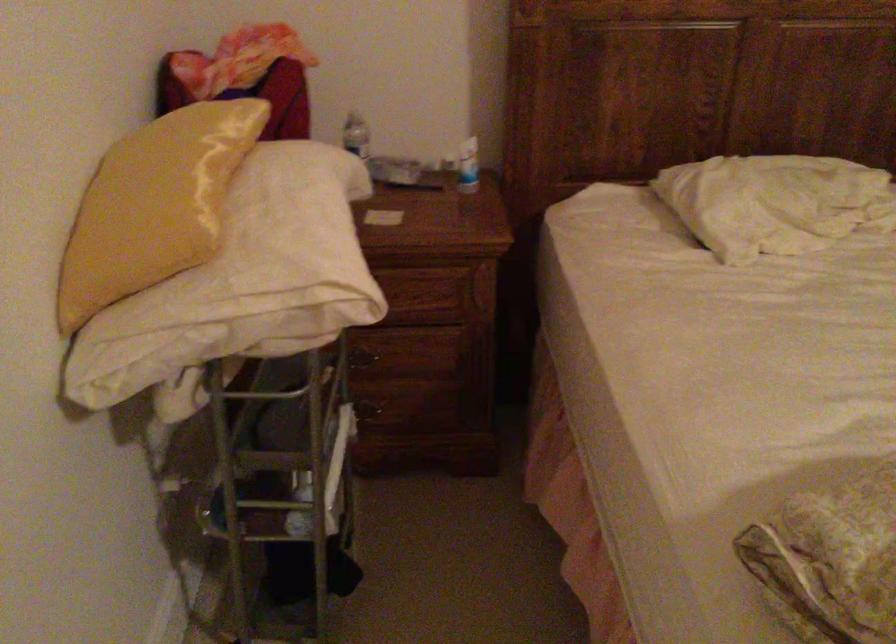
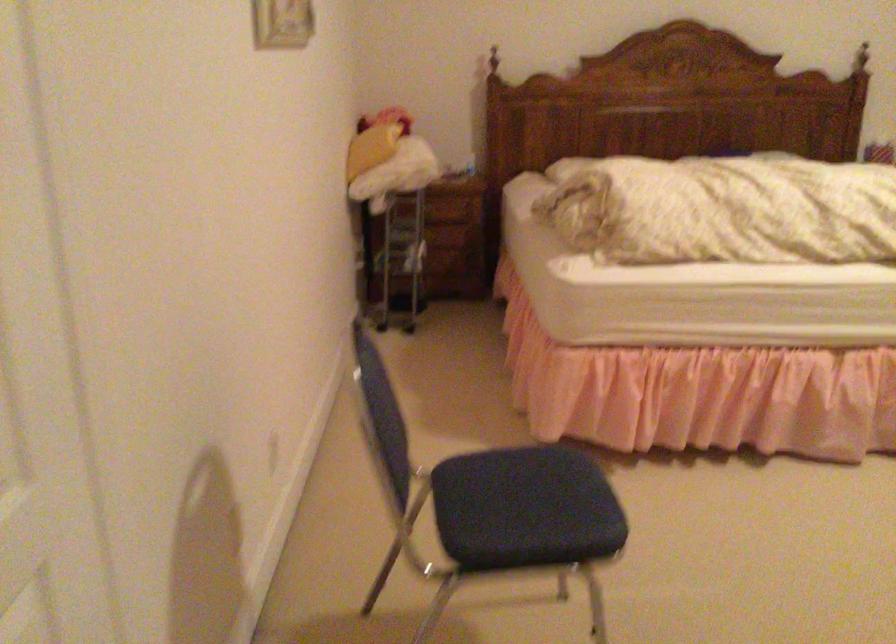
Question: Which direction would the cameraman need to move to produce the second image? Reply with the corresponding letter.

Choices:
 (A) Left
 (B) Right
 (C) Forward
 (D) Backward

Answer: (D)